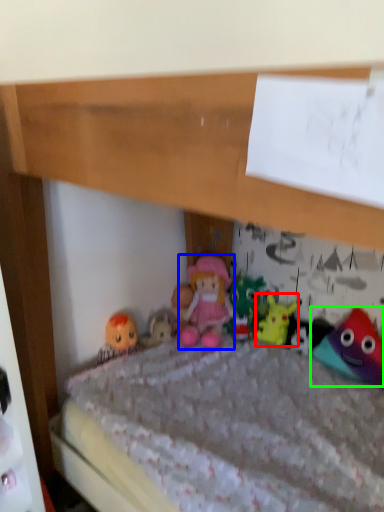
Question: Based on their relative distances, which object is nearer to toy (highlighted by a red box)? Choose from person (highlighted by a blue box) and toy (highlighted by a green box).

Choices:
 (A) person
 (B) toy

Answer: (A)